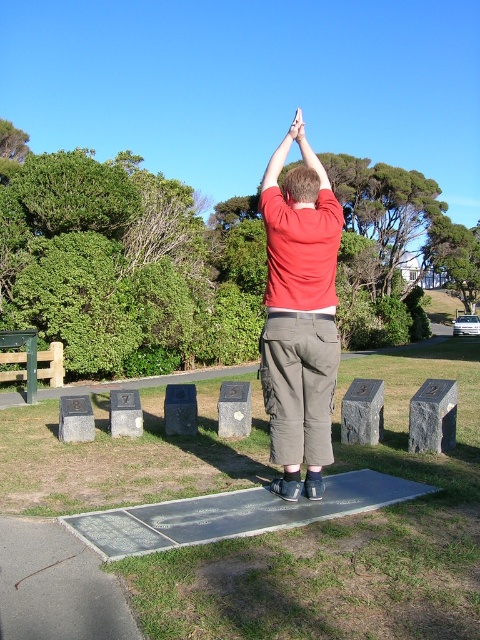
Question: Which point is closer to the camera?

Choices:
 (A) (290, 198)
 (B) (304, 349)

Answer: (B)

Question: Which of the following is the closest to the observer?

Choices:
 (A) (296, 426)
 (B) (296, 196)

Answer: (B)

Question: Is the position of matte red shirt at center more distant than that of brown hair at upper center?

Choices:
 (A) yes
 (B) no

Answer: (A)

Question: Which point is closer to the camera?

Choices:
 (A) (300, 428)
 (B) (324, 176)

Answer: (A)

Question: Can you confirm if matte red shirt at center is wider than brown hair at upper center?

Choices:
 (A) yes
 (B) no

Answer: (A)

Question: Can you confirm if matte red shirt at center is positioned below brown hair at upper center?

Choices:
 (A) no
 (B) yes

Answer: (A)